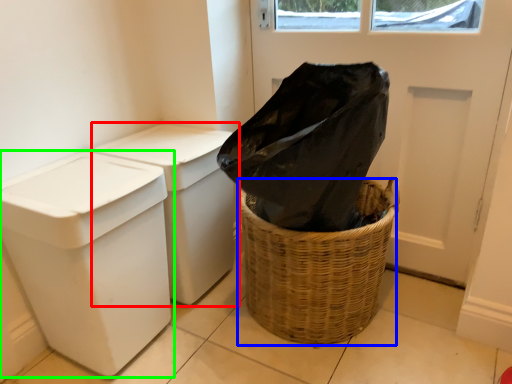
Question: Which is nearer to the waste container (highlighted by a red box)? basket container (highlighted by a blue box) or waste container (highlighted by a green box).

Choices:
 (A) basket container
 (B) waste container

Answer: (B)